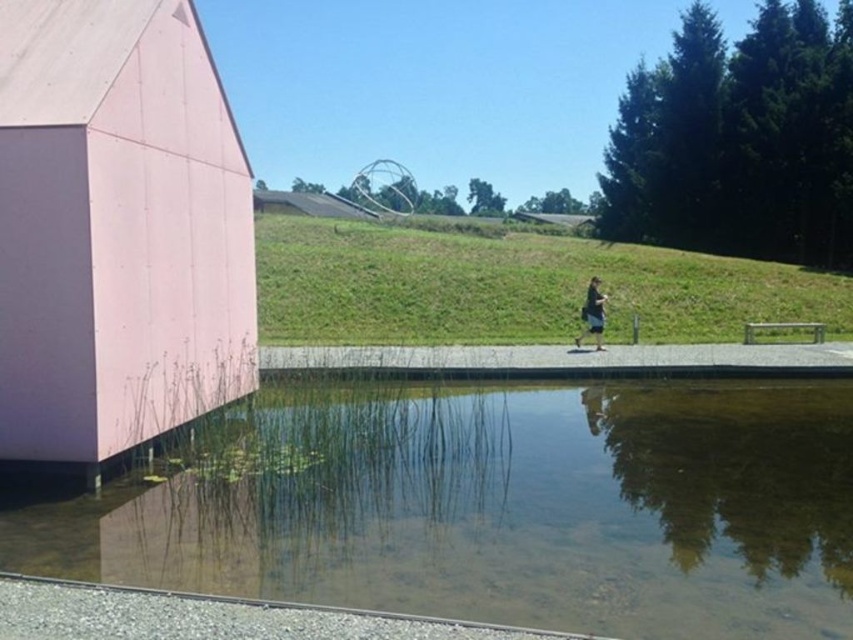
Is point (590, 608) less distant than point (113, 17)?

Yes.

Is the position of clear glass water at lower center more distant than that of matte pink wall at left?

No, it is in front of matte pink wall at left.

Find the location of a particular element. clear glass water at lower center is located at coordinates (495, 506).

You are a GUI agent. You are given a task and a screenshot of the screen. Output one action in this format:
    pyautogui.click(x=<x>, y=<y>)
    Task: Click on the clear glass water at lower center
    
    Given the screenshot: What is the action you would take?
    (495, 506)

Which is in front, point (643, 576) or point (585, 316)?

Point (643, 576)

You are a GUI agent. You are given a task and a screenshot of the screen. Output one action in this format:
    pyautogui.click(x=<x>, y=<y>)
    Task: Click on the clear glass water at lower center
    The image size is (853, 640).
    Given the screenshot: What is the action you would take?
    click(x=495, y=506)

This screenshot has height=640, width=853. Identify the location of clear glass water at lower center. (495, 506).

Is matte pink wall at left positioned at the back of black fabric at center?

No.

Is point (32, 228) farther from viewer compared to point (602, 323)?

No, it is in front of (602, 323).

Where is `matte pink wall at left`? Image resolution: width=853 pixels, height=640 pixels. matte pink wall at left is located at coordinates (115, 230).